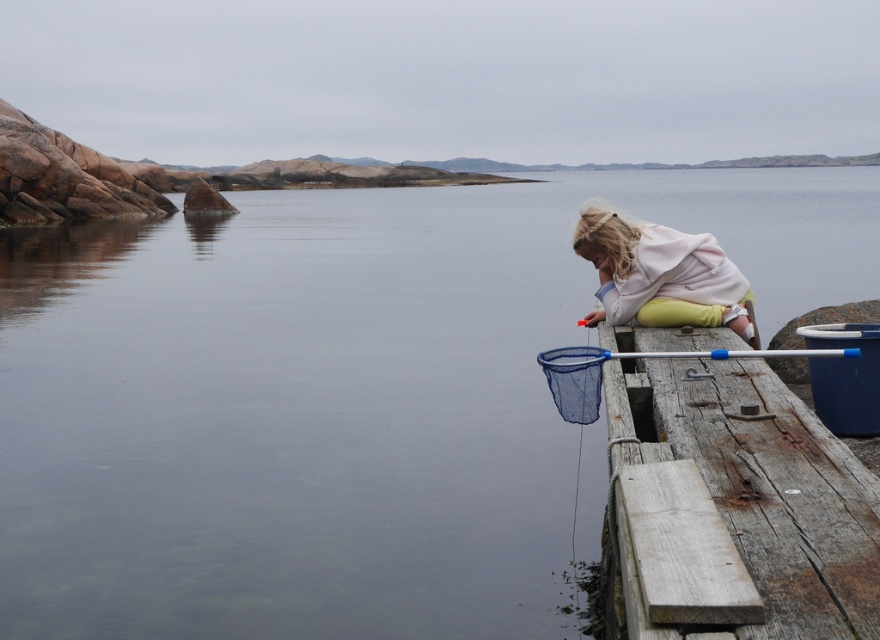
Can you confirm if light pink fleece at right is positioned above blue plastic fishing pole at right?

Correct, light pink fleece at right is located above blue plastic fishing pole at right.

Which of these two, light pink fleece at right or blue plastic fishing pole at right, stands shorter?

With less height is blue plastic fishing pole at right.

Does point (700, 243) come closer to viewer compared to point (594, 353)?

No.

Identify the location of light pink fleece at right. The image size is (880, 640). (662, 275).

Between clear water at dock right and blue plastic fishing pole at right, which one is positioned lower?

blue plastic fishing pole at right is below.

Who is shorter, clear water at dock right or blue plastic fishing pole at right?

blue plastic fishing pole at right

Which is in front, point (783, 259) or point (545, 365)?

Point (545, 365) is in front.

Where is `clear water at dock right`? The width and height of the screenshot is (880, 640). clear water at dock right is located at coordinates (339, 397).

Between weathered wood dock at lower right and blue plastic fishing pole at right, which one is positioned higher?

blue plastic fishing pole at right is higher up.

Is weathered wood dock at lower right bigger than blue plastic fishing pole at right?

Yes.

Which is behind, point (816, 605) or point (686, 356)?

The point (686, 356) is behind.

Where is `weathered wood dock at lower right`? The image size is (880, 640). weathered wood dock at lower right is located at coordinates (737, 508).